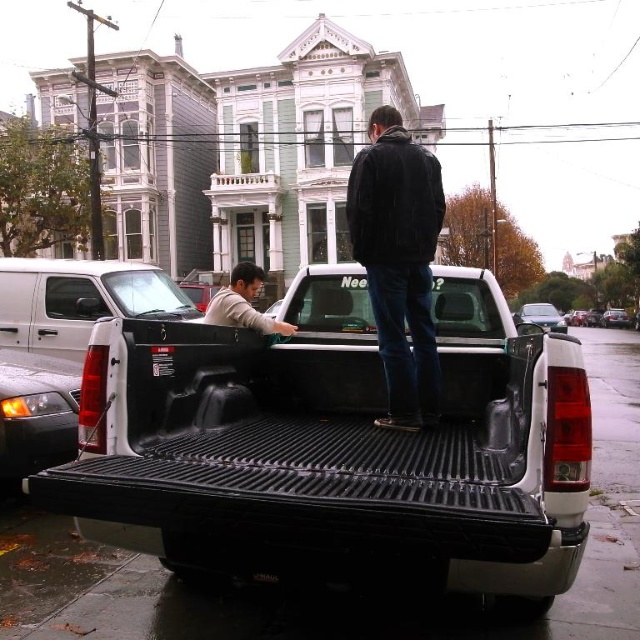
Which is behind, point (369, 179) or point (157, 301)?

The point (157, 301) is behind.

Is point (404, 374) positioned behind point (52, 328)?

No, (404, 374) is in front of (52, 328).

Who is more forward, (369, 230) or (10, 330)?

Point (369, 230) is in front.

The width and height of the screenshot is (640, 640). I want to click on dark blue jeans at center, so click(397, 260).

Measure the distance between white matte truck bed at center and camera.

7.95 meters

From the picture: Does white matte truck bed at center have a lesser height compared to gray matte shirt at center?

Yes.

Is point (13, 326) positioned in front of point (227, 300)?

No, it is behind (227, 300).

Identify the location of white matte truck bed at center. Image resolution: width=640 pixels, height=640 pixels. (80, 300).

Does black textured truck bed at center have a greater height compared to gray matte shirt at center?

No, black textured truck bed at center is not taller than gray matte shirt at center.

Which is above, black textured truck bed at center or gray matte shirt at center?

gray matte shirt at center

What do you see at coordinates (337, 445) in the screenshot?
I see `black textured truck bed at center` at bounding box center [337, 445].

Where is `black textured truck bed at center`? The image size is (640, 640). black textured truck bed at center is located at coordinates (337, 445).